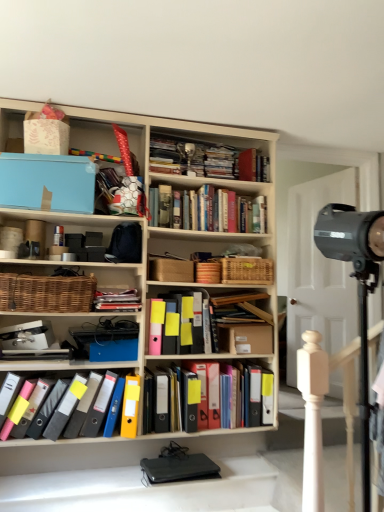
Question: Does black plastic wallet at lower center appear on the left side of woven brown basket at left?

Choices:
 (A) no
 (B) yes

Answer: (A)

Question: Is black plastic wallet at lower center outside woven brown basket at left?

Choices:
 (A) yes
 (B) no

Answer: (A)

Question: Considering the relative sizes of black plastic wallet at lower center and woven brown basket at left in the image provided, is black plastic wallet at lower center bigger than woven brown basket at left?

Choices:
 (A) yes
 (B) no

Answer: (B)

Question: Is black plastic wallet at lower center to the right of woven brown basket at left from the viewer's perspective?

Choices:
 (A) no
 (B) yes

Answer: (B)

Question: Is black plastic wallet at lower center shorter than woven brown basket at left?

Choices:
 (A) yes
 (B) no

Answer: (A)

Question: From the image's perspective, would you say black plastic wallet at lower center is positioned over woven brown basket at left?

Choices:
 (A) no
 (B) yes

Answer: (A)

Question: Can you confirm if black plastic wallet at lower center is wider than matte black folders at center, the 2th book in the top-to-bottom sequence?

Choices:
 (A) yes
 (B) no

Answer: (B)

Question: From a real-world perspective, is black plastic wallet at lower center on top of matte black folders at center, the third book in the bottom-to-top sequence?

Choices:
 (A) yes
 (B) no

Answer: (B)

Question: From the image's perspective, does black plastic wallet at lower center appear higher than matte black folders at center, the 2th book in the top-to-bottom sequence?

Choices:
 (A) no
 (B) yes

Answer: (A)

Question: From the image's perspective, does black plastic wallet at lower center appear lower than matte black folders at center, the 2th book in the top-to-bottom sequence?

Choices:
 (A) no
 (B) yes

Answer: (B)

Question: Considering the relative sizes of black plastic wallet at lower center and matte black folders at center, the 2th book in the top-to-bottom sequence, in the image provided, is black plastic wallet at lower center taller than matte black folders at center, the 2th book in the top-to-bottom sequence,?

Choices:
 (A) no
 (B) yes

Answer: (B)

Question: Is matte black folders at center, the 2th book in the top-to-bottom sequence, a part of black plastic wallet at lower center?

Choices:
 (A) no
 (B) yes

Answer: (A)

Question: Is matte black folders at center, the 2th book in the top-to-bottom sequence, touching woven brown basket at left?

Choices:
 (A) no
 (B) yes

Answer: (A)